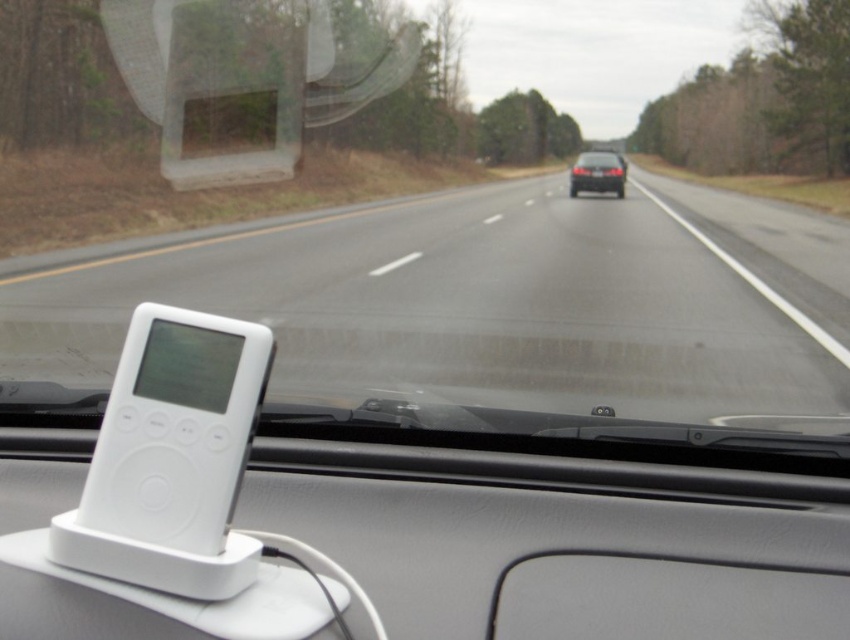
Can you confirm if white matte ipod at center is smaller than black glossy sedan at center?

Yes.

Does point (261, 397) come behind point (601, 170)?

No, (261, 397) is in front of (601, 170).

I want to click on white matte ipod at center, so click(x=177, y=429).

Is point (718, 250) behind point (242, 397)?

Yes.

Is white plastic device at center smaller than white matte ipod at center?

Result: Incorrect, white plastic device at center is not smaller in size than white matte ipod at center.

Identify the location of white plastic device at center. (486, 305).

You are a GUI agent. You are given a task and a screenshot of the screen. Output one action in this format:
    pyautogui.click(x=<x>, y=<y>)
    Task: Click on the white plastic device at center
    
    Given the screenshot: What is the action you would take?
    pyautogui.click(x=486, y=305)

Does white plastic device at center have a lesser width compared to black glossy sedan at center?

No, white plastic device at center is not thinner than black glossy sedan at center.

How much distance is there between white plastic device at center and black glossy sedan at center?

white plastic device at center is 53.23 feet away from black glossy sedan at center.

Locate an element on the screen. white plastic device at center is located at coordinates (486, 305).

The height and width of the screenshot is (640, 850). What are the coordinates of `white plastic device at center` in the screenshot? It's located at (486, 305).